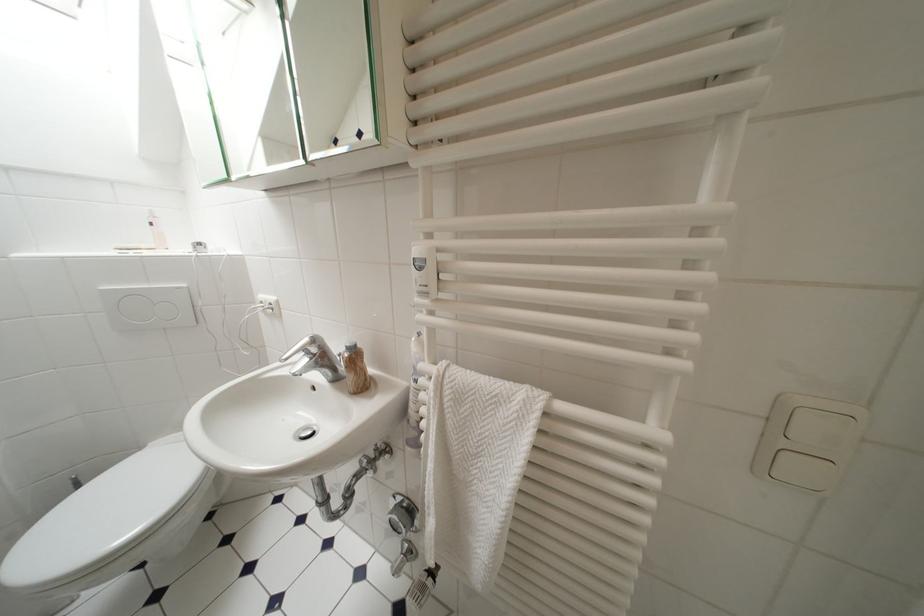
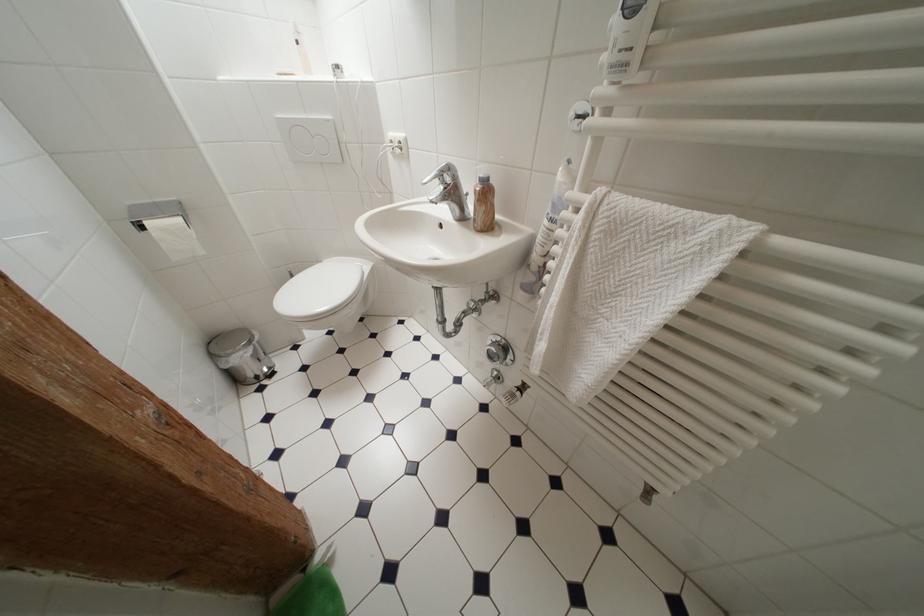
The point at (x=148, y=451) is marked in the first image. Where is the corresponding point in the second image?

(325, 265)